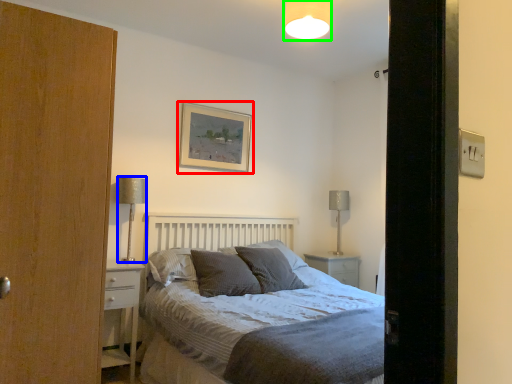
Question: Estimate the real-world distances between objects in this image. Which object is farther from picture frame (highlighted by a red box), table lamp (highlighted by a blue box) or light fixture (highlighted by a green box)?

Choices:
 (A) table lamp
 (B) light fixture

Answer: (B)